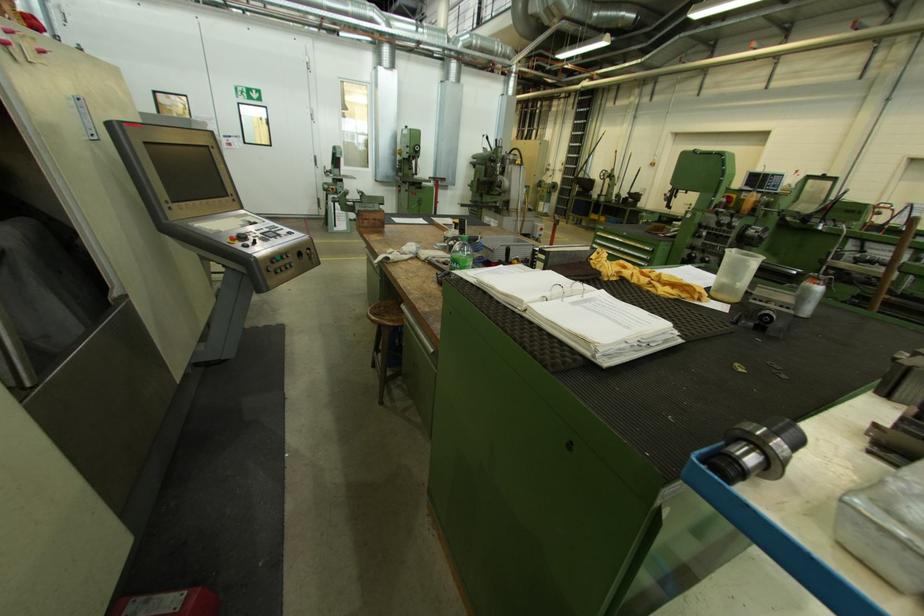
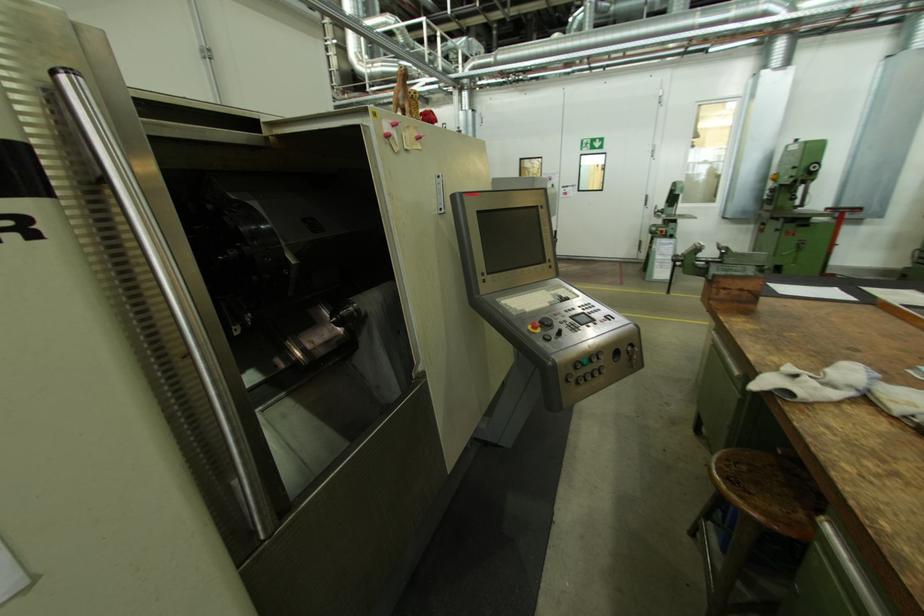
Question: Based on the continuous images, in which direction is the camera rotating? Reply with the corresponding letter.

Choices:
 (A) Left
 (B) Right
 (C) Up
 (D) Down

Answer: (A)